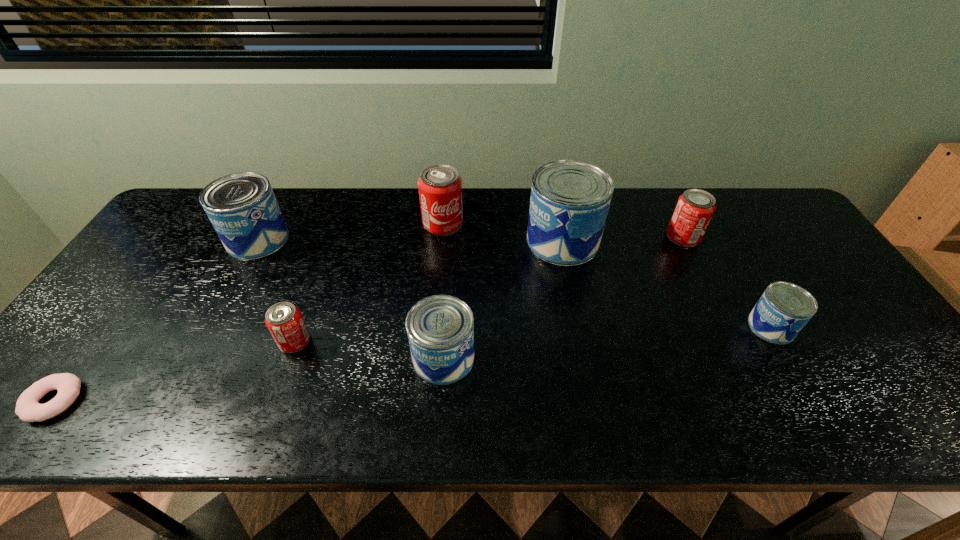
Where is `vacant space at the near edge of the desktop`? The width and height of the screenshot is (960, 540). vacant space at the near edge of the desktop is located at coordinates (536, 416).

Locate an element on the screen. vacant region at the left edge of the desktop is located at coordinates (139, 321).

The width and height of the screenshot is (960, 540). I want to click on vacant space at the right edge of the desktop, so click(760, 237).

Find the location of a particular element. This screenshot has width=960, height=540. vacant region at the far right corner of the desktop is located at coordinates (760, 218).

Identify the location of free space at the near right corner. (882, 414).

This screenshot has height=540, width=960. I want to click on vacant point located between the leftmost red can and the second can from right to left, so click(489, 289).

At what (x,y) coordinates should I click in order to perform the action: click on free space that is in between the leftmost red can and the doughnut. Please return your answer as a coordinate pair (x, y). The width and height of the screenshot is (960, 540). Looking at the image, I should click on (174, 371).

Identify the location of empty location between the leftmost red can and the second blue can from left to right. Image resolution: width=960 pixels, height=540 pixels. (369, 349).

This screenshot has height=540, width=960. What are the coordinates of `free area in between the second object from right to left and the shortest object` in the screenshot? It's located at (369, 319).

Locate an element on the screen. Image resolution: width=960 pixels, height=540 pixels. vacant space that is in between the second object from right to left and the third object from right to left is located at coordinates (623, 239).